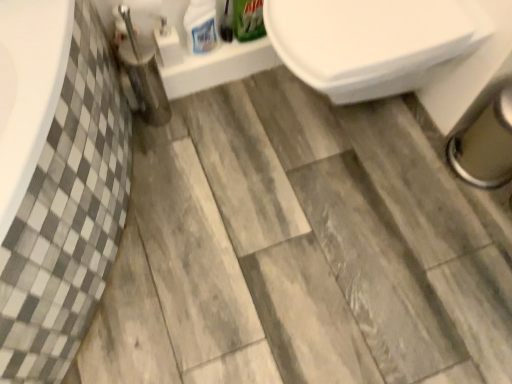
Question: From the image's perspective, does brushed metal toilet brush at lower left appear lower than white glossy bottle at upper center, which is the 2th cleaning product from right to left?

Choices:
 (A) yes
 (B) no

Answer: (A)

Question: Are brushed metal toilet brush at lower left and white glossy bottle at upper center, which is the 2th cleaning product from right to left, located far from each other?

Choices:
 (A) yes
 (B) no

Answer: (B)

Question: From the image's perspective, is brushed metal toilet brush at lower left on top of white glossy bottle at upper center, which is the 2th cleaning product from right to left?

Choices:
 (A) no
 (B) yes

Answer: (A)

Question: Considering the relative sizes of brushed metal toilet brush at lower left and white glossy bottle at upper center, which is the 2th cleaning product from right to left, in the image provided, is brushed metal toilet brush at lower left wider than white glossy bottle at upper center, which is the 2th cleaning product from right to left,?

Choices:
 (A) yes
 (B) no

Answer: (A)

Question: Is brushed metal toilet brush at lower left closer to the viewer compared to white glossy bottle at upper center, which is the 2th cleaning product from right to left?

Choices:
 (A) yes
 (B) no

Answer: (A)

Question: Is white glossy bottle at upper center, placed as the first cleaning product when sorted from left to right, situated inside green matte box at upper center, acting as the second cleaning product starting from the left, or outside?

Choices:
 (A) inside
 (B) outside

Answer: (B)

Question: In the image, is white glossy bottle at upper center, placed as the first cleaning product when sorted from left to right, on the left side or the right side of green matte box at upper center, acting as the second cleaning product starting from the left?

Choices:
 (A) right
 (B) left

Answer: (B)

Question: From the image's perspective, relative to green matte box at upper center, acting as the second cleaning product starting from the left, is white glossy bottle at upper center, which is the 2th cleaning product from right to left, above or below?

Choices:
 (A) below
 (B) above

Answer: (A)

Question: Relative to green matte box at upper center, which is the 1th cleaning product in right-to-left order, is white glossy bottle at upper center, placed as the first cleaning product when sorted from left to right, in front or behind?

Choices:
 (A) front
 (B) behind

Answer: (A)

Question: Is white glossy bottle at upper center, placed as the first cleaning product when sorted from left to right, bigger or smaller than white glossy toilet at upper right?

Choices:
 (A) small
 (B) big

Answer: (A)

Question: Which is correct: white glossy bottle at upper center, placed as the first cleaning product when sorted from left to right, is inside white glossy toilet at upper right, or outside of it?

Choices:
 (A) inside
 (B) outside

Answer: (B)

Question: Is white glossy bottle at upper center, placed as the first cleaning product when sorted from left to right, wider or thinner than white glossy toilet at upper right?

Choices:
 (A) thin
 (B) wide

Answer: (A)

Question: From a real-world perspective, relative to white glossy toilet at upper right, is white glossy bottle at upper center, placed as the first cleaning product when sorted from left to right, vertically above or below?

Choices:
 (A) below
 (B) above

Answer: (B)

Question: Is point (487, 21) closer or farther from the camera than point (200, 41)?

Choices:
 (A) farther
 (B) closer

Answer: (B)

Question: Is white glossy toilet at upper right in front of or behind white glossy bottle at upper center, placed as the first cleaning product when sorted from left to right, in the image?

Choices:
 (A) behind
 (B) front

Answer: (B)